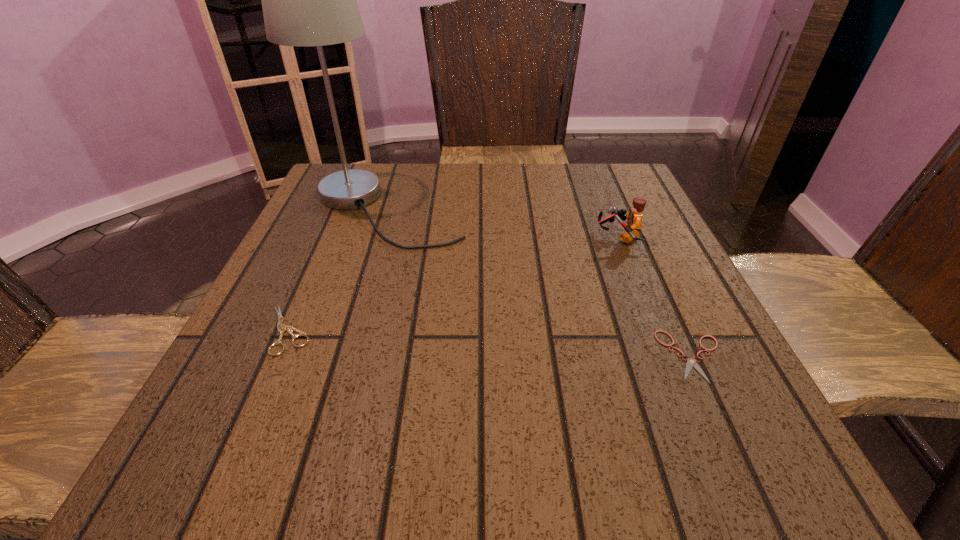
You are a GUI agent. You are given a task and a screenshot of the screen. Output one action in this format:
    pyautogui.click(x=<x>, y=<y>)
    Task: Click on the free space located 0.090m on the back of the second shortest object
    The image size is (960, 540).
    Given the screenshot: What is the action you would take?
    pyautogui.click(x=314, y=273)

This screenshot has width=960, height=540. I want to click on free point located on the left of the shorter shears, so click(x=554, y=356).

This screenshot has height=540, width=960. What are the coordinates of `object present at the far edge` in the screenshot? It's located at (308, 0).

Locate an element on the screen. This screenshot has width=960, height=540. table lamp situated at the left edge is located at coordinates (308, 0).

I want to click on shears that is at the left edge, so point(282,329).

This screenshot has height=540, width=960. In order to click on Lego at the right edge in this screenshot , I will do `click(634, 218)`.

This screenshot has height=540, width=960. Identify the location of shears situated at the right edge. (691, 362).

Locate an element on the screen. This screenshot has width=960, height=540. object present at the far left corner is located at coordinates (308, 0).

At what (x,y) coordinates should I click in order to perform the action: click on vacant space at the far edge of the desktop. Please return your answer as a coordinate pair (x, y). Image resolution: width=960 pixels, height=540 pixels. Looking at the image, I should click on (460, 203).

Locate an element on the screen. vacant space at the near edge is located at coordinates (529, 485).